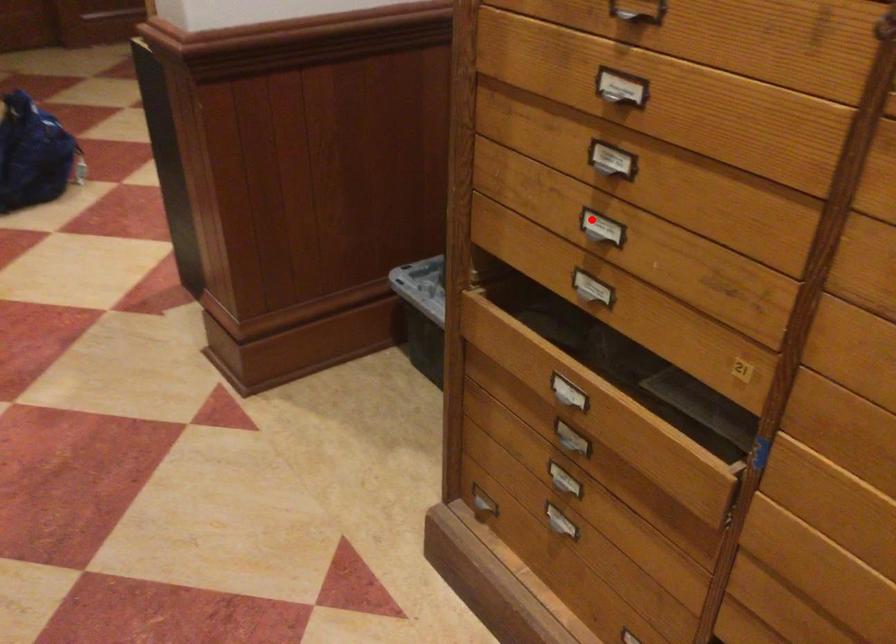
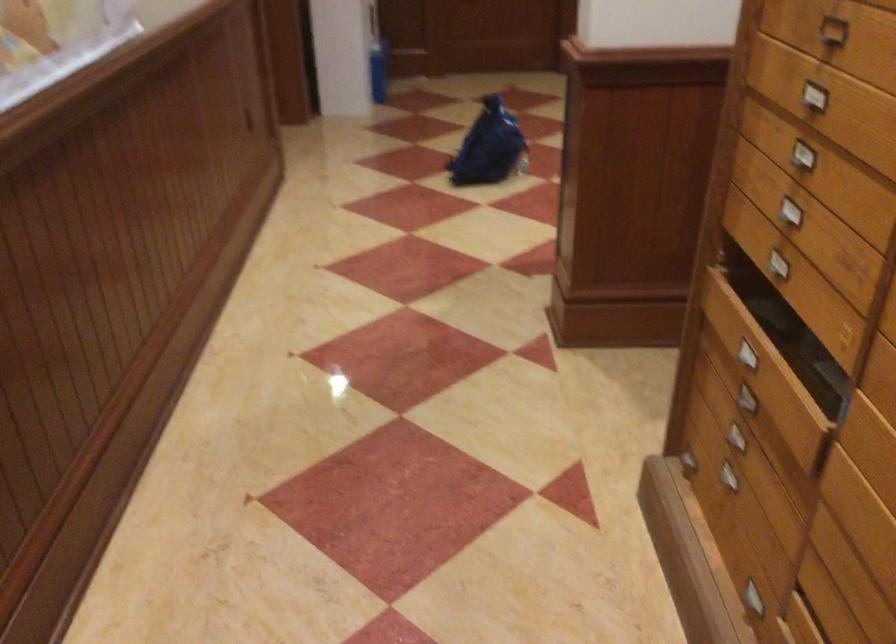
In the second image, find the point that corresponds to the highlighted location in the first image.

(791, 205)